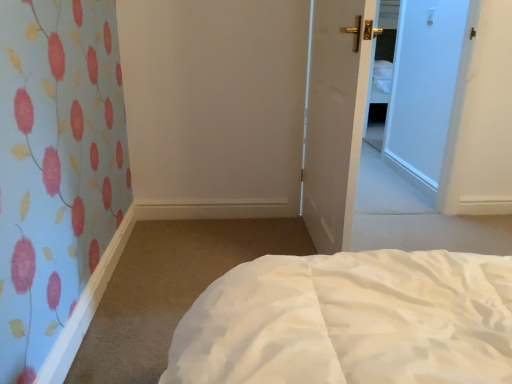
Question: Can you confirm if white matte door at center is positioned to the left of white soft bed at lower center?

Choices:
 (A) yes
 (B) no

Answer: (A)

Question: From the image's perspective, is white matte door at center located beneath white soft bed at lower center?

Choices:
 (A) yes
 (B) no

Answer: (B)

Question: From the image's perspective, would you say white matte door at center is positioned over white soft bed at lower center?

Choices:
 (A) no
 (B) yes

Answer: (B)

Question: Considering the relative sizes of white matte door at center and white soft bed at lower center in the image provided, is white matte door at center shorter than white soft bed at lower center?

Choices:
 (A) no
 (B) yes

Answer: (A)

Question: From a real-world perspective, does white matte door at center stand above white soft bed at lower center?

Choices:
 (A) no
 (B) yes

Answer: (B)

Question: Is white matte door at center located outside white soft bed at lower center?

Choices:
 (A) yes
 (B) no

Answer: (A)

Question: Considering the relative sizes of white soft bed at lower center and white matte door at center in the image provided, is white soft bed at lower center wider than white matte door at center?

Choices:
 (A) no
 (B) yes

Answer: (B)

Question: Does white soft bed at lower center have a lesser width compared to white matte door at center?

Choices:
 (A) no
 (B) yes

Answer: (A)

Question: Is white soft bed at lower center taller than white matte door at center?

Choices:
 (A) no
 (B) yes

Answer: (A)

Question: From the image's perspective, does white soft bed at lower center appear lower than white matte door at center?

Choices:
 (A) yes
 (B) no

Answer: (A)

Question: Is white soft bed at lower center positioned behind white matte door at center?

Choices:
 (A) yes
 (B) no

Answer: (B)

Question: Is white soft bed at lower center positioned in front of white matte door at center?

Choices:
 (A) no
 (B) yes

Answer: (B)

Question: Considering the positions of white soft bed at lower center and white matte door at center in the image, is white soft bed at lower center bigger or smaller than white matte door at center?

Choices:
 (A) small
 (B) big

Answer: (A)